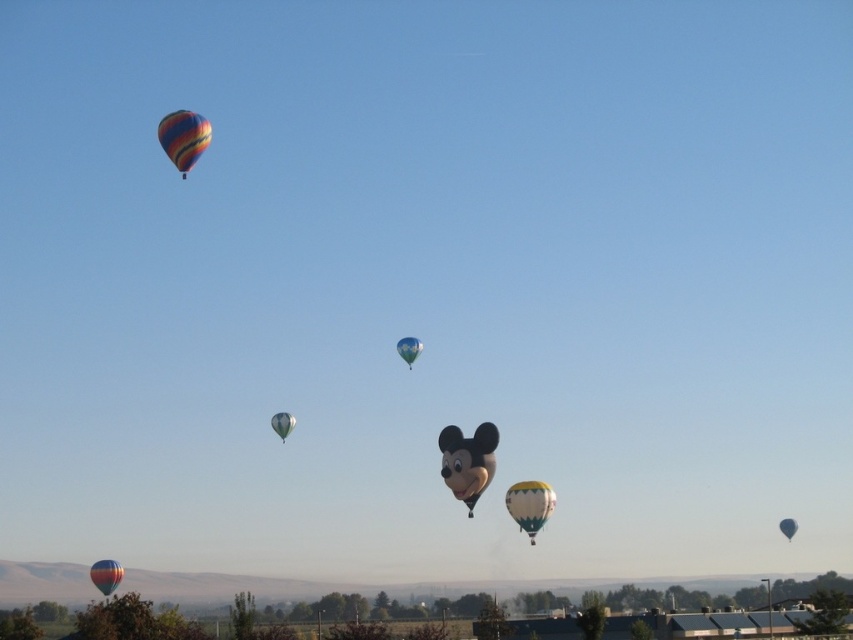
You are a photographer trying to capture a shot of the matte black mickey mouse head at center and the blue glossy balloon at center. Which one appears lower in the frame?

The matte black mickey mouse head at center is below the blue glossy balloon at center, so it appears lower in the frame.

You are a photographer trying to capture a shot of the multicolored fabric hot air balloon at upper left and the matte silver balloon at center. Based on their positions, which balloon is located to the right of the other?

The matte silver balloon at center is located to the right of the multicolored fabric hot air balloon at upper left.

You are a photographer planning to capture a wide shot of the scene. You want to ensure both the matte black mickey mouse head at center and the matte red balloon at lower left are fully visible in your frame. Based on their sizes in the image, which balloon should you prioritize positioning closer to the center of your camera frame to ensure it doesn

The matte black mickey mouse head at center occupies less space than the matte red balloon at lower left. To ensure both are fully visible, prioritize positioning the larger matte red balloon at lower left closer to the center of your camera frame since it requires more space to fit within the shot.